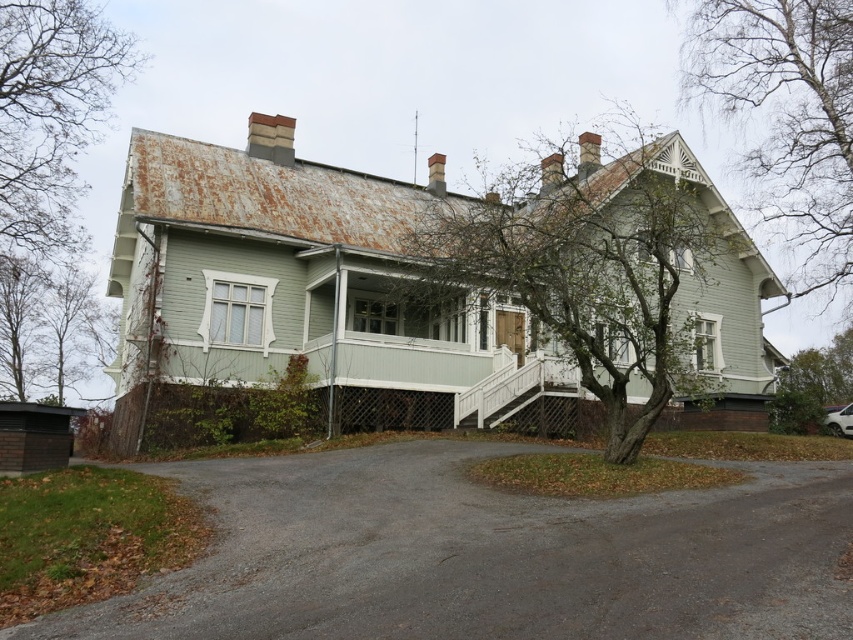
Does point (515, 205) come behind point (845, 394)?

No.

Is green wood tree at center below green wood tree at right?

Incorrect, green wood tree at center is not positioned below green wood tree at right.

Identify the location of green wood tree at center. (589, 272).

Does gray asphalt driveway at lower center have a greater width compared to green wood tree at center?

Incorrect, gray asphalt driveway at lower center's width does not surpass green wood tree at center's.

Is gray asphalt driveway at lower center below green wood tree at center?

Indeed, gray asphalt driveway at lower center is positioned under green wood tree at center.

The width and height of the screenshot is (853, 640). I want to click on gray asphalt driveway at lower center, so click(486, 556).

Based on the photo, does bare branches at upper right appear under green wood tree at right?

No, bare branches at upper right is not below green wood tree at right.

Which is behind, point (726, 65) or point (778, 424)?

Positioned behind is point (726, 65).

Where is `bare branches at upper right`? bare branches at upper right is located at coordinates (786, 116).